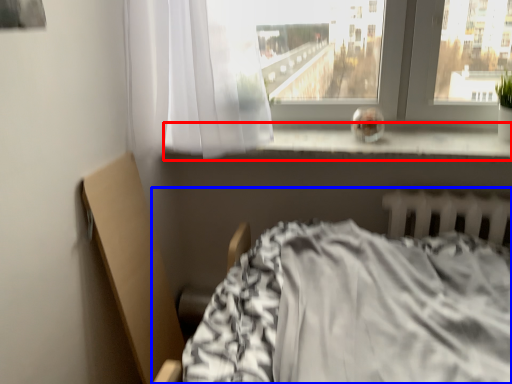
Question: Which object appears farthest to the camera in this image, window sill (highlighted by a red box) or bed (highlighted by a blue box)?

Choices:
 (A) window sill
 (B) bed

Answer: (A)